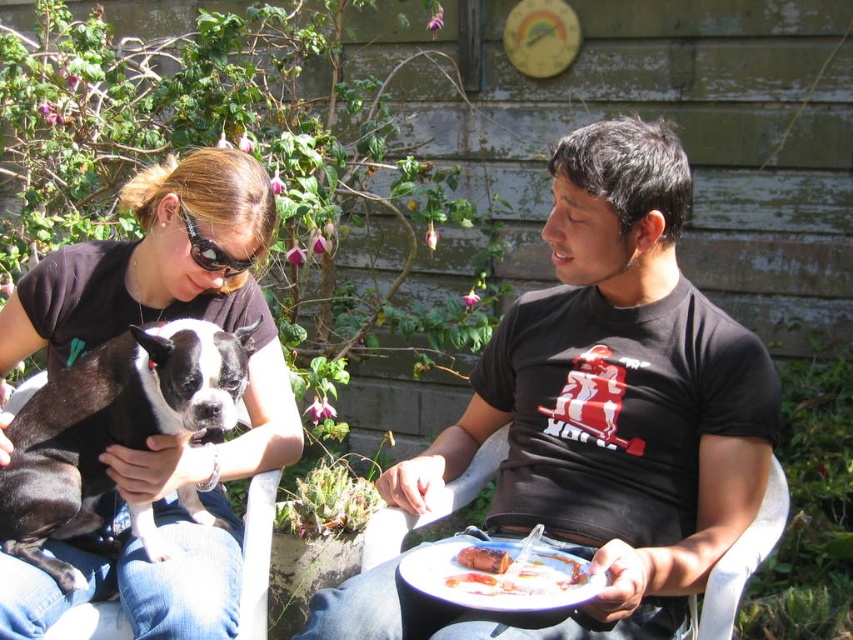
You are setting up a picnic and need to place a snack for the black matte dog at left and the white plastic plate at lower center. Which object should you place first to ensure the dog can reach its snack without disturbing the plate?

You should place the white plastic plate at lower center first because the black matte dog at left is to the left of it, so placing the plate after ensures the dog can reach its snack without moving the plate.

You are planning to place a small toy for the black matte dog at left on the white plastic plate at lower center. Considering their sizes, will the toy fit on the plate without falling off?

The black matte dog at left is much taller than the white plastic plate at lower center, so the toy might not fit properly on the plate and could easily fall off due to the size difference.